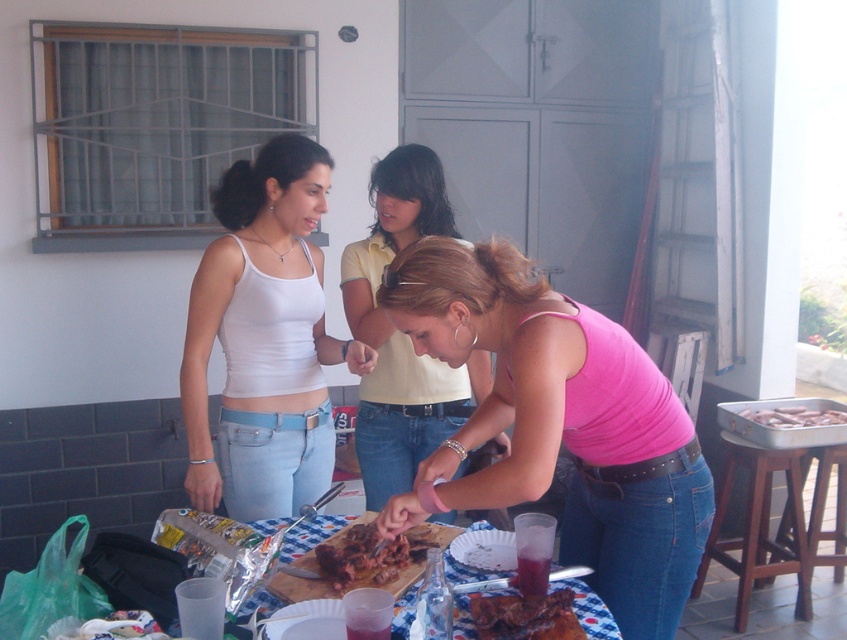
Which is behind, point (840, 561) or point (485, 614)?

The point (840, 561) is behind.

Image resolution: width=847 pixels, height=640 pixels. Describe the element at coordinates (762, 528) in the screenshot. I see `wooden stool at lower right` at that location.

I want to click on wooden stool at lower right, so click(762, 528).

The height and width of the screenshot is (640, 847). Describe the element at coordinates (558, 426) in the screenshot. I see `pink matte tank top at center` at that location.

Does point (637, 397) come closer to viewer compared to point (845, 419)?

Yes, it is.

This screenshot has height=640, width=847. Find the location of `pink matte tank top at center`. pink matte tank top at center is located at coordinates (558, 426).

Is point (623, 400) less distant than point (357, 408)?

Yes, it is in front of point (357, 408).

Between pink matte tank top at center and pink fabric shirt at center, which one is positioned lower?

pink matte tank top at center is below.

Identify the location of pink matte tank top at center. Image resolution: width=847 pixels, height=640 pixels. (558, 426).